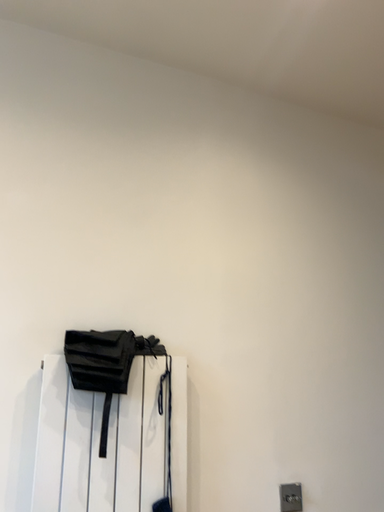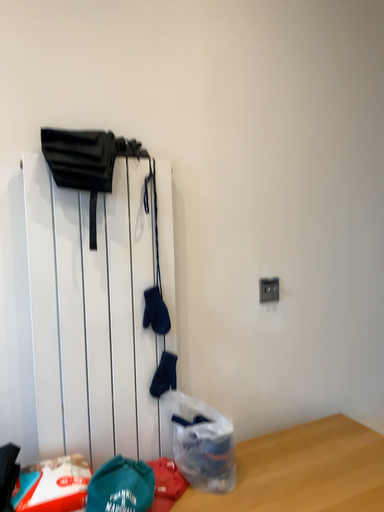
Question: How did the camera likely rotate when shooting the video?

Choices:
 (A) rotated downward
 (B) rotated upward

Answer: (A)